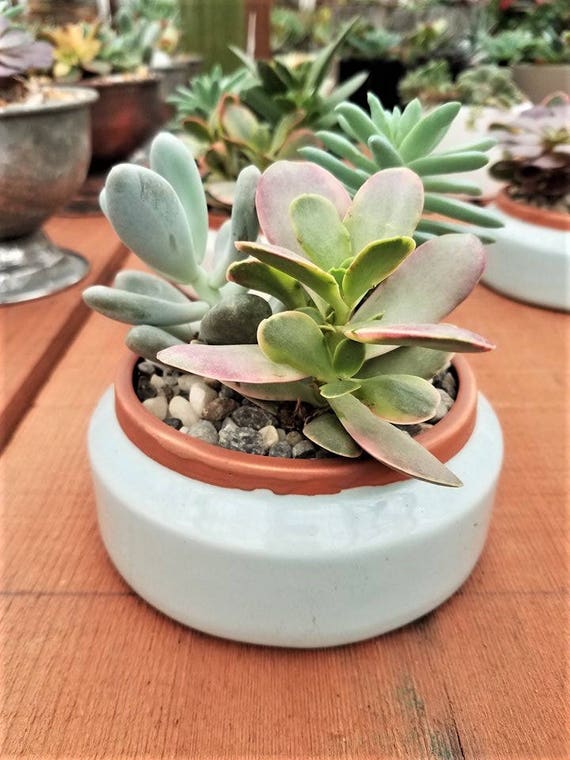
The width and height of the screenshot is (570, 760). Identify the location of metal pot. (32, 171), (136, 100), (170, 77).